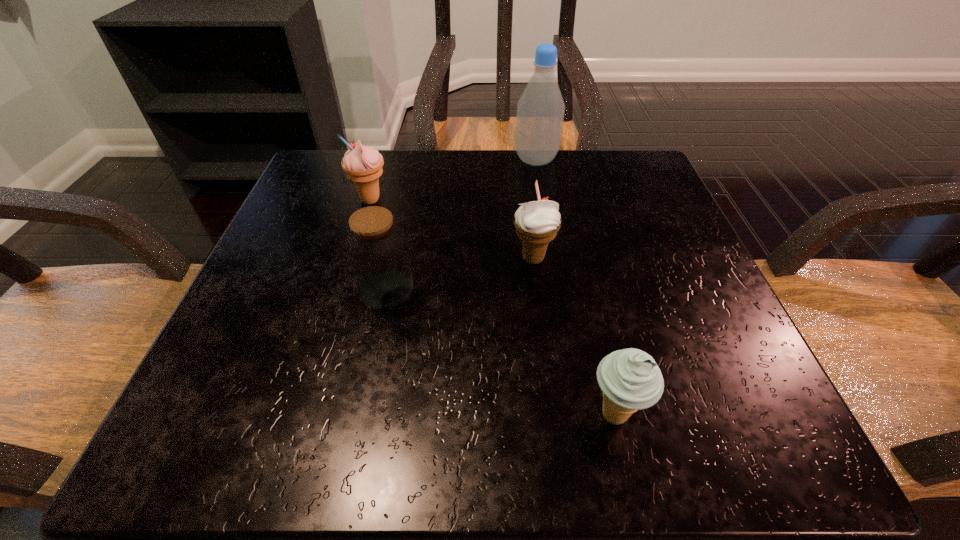
At what (x,y) coordinates should I click in order to perform the action: click on vacant space at the left edge of the desktop. Please return your answer as a coordinate pair (x, y). The height and width of the screenshot is (540, 960). Looking at the image, I should click on (314, 315).

At what (x,y) coordinates should I click in order to perform the action: click on blank space at the right edge of the desktop. Please return your answer as a coordinate pair (x, y). This screenshot has width=960, height=540. Looking at the image, I should click on (690, 277).

The height and width of the screenshot is (540, 960). Find the location of `free space at the far right corner of the desktop`. free space at the far right corner of the desktop is located at coordinates (607, 207).

Identify the location of free space at the near right corner of the desktop. The height and width of the screenshot is (540, 960). (751, 418).

Find the location of a particular element. vacant area that lies between the bottle and the jar is located at coordinates (461, 225).

Find the location of a particular element. The width and height of the screenshot is (960, 540). free space between the bottle and the leftmost icecream is located at coordinates 453,180.

You are a GUI agent. You are given a task and a screenshot of the screen. Output one action in this format:
    pyautogui.click(x=<x>, y=<y>)
    Task: Click on the free spot between the farthest object and the jar
    Image resolution: width=960 pixels, height=540 pixels.
    Given the screenshot: What is the action you would take?
    pyautogui.click(x=461, y=225)

The width and height of the screenshot is (960, 540). What are the coordinates of `vacant space that is in between the nearest icecream and the jar` in the screenshot? It's located at pos(500,352).

Find the location of a particular element. free spot between the leftmost icecream and the farthest object is located at coordinates (453, 180).

Where is `vacant area that lies between the leftmost icecream and the second icecream from left to right`? The width and height of the screenshot is (960, 540). vacant area that lies between the leftmost icecream and the second icecream from left to right is located at coordinates (452, 229).